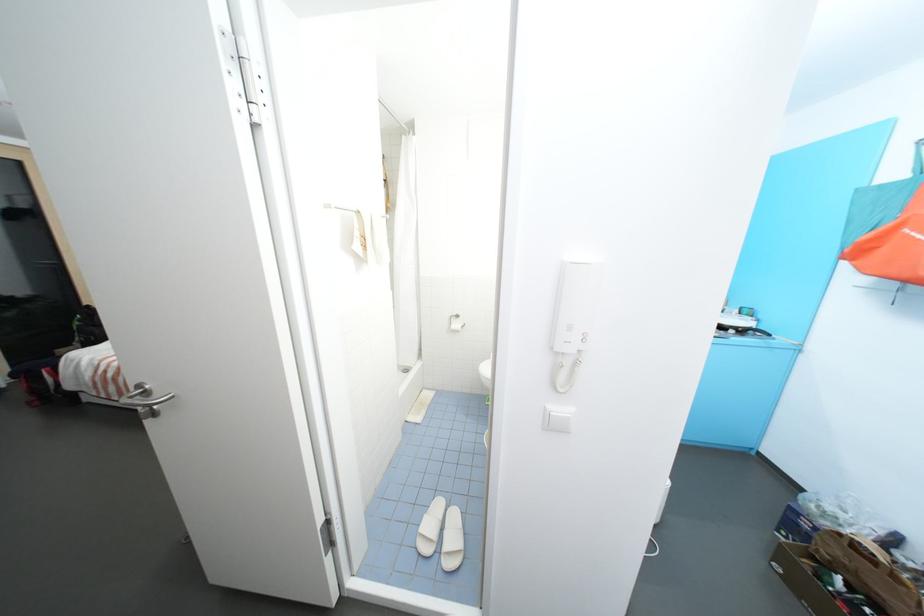
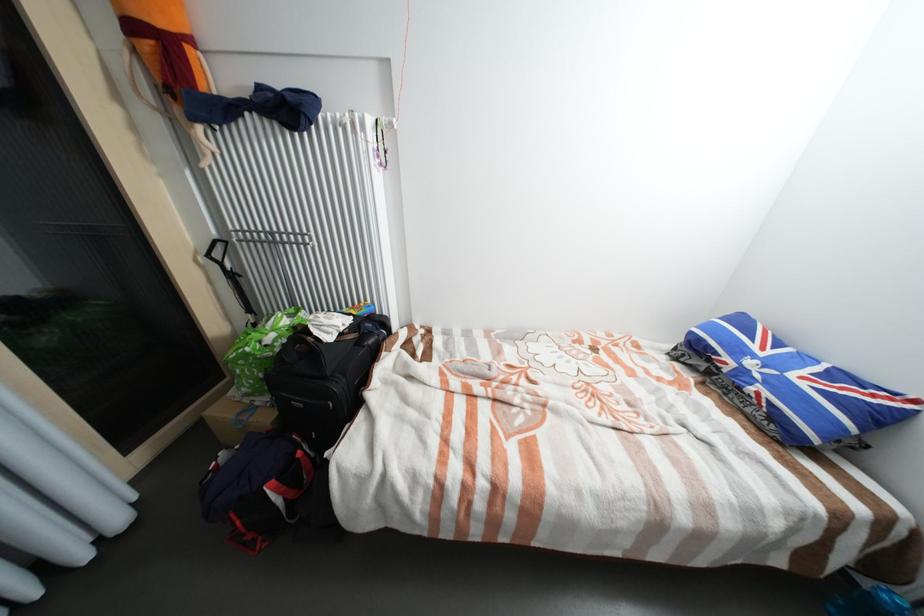
The images are taken continuously from a first-person perspective. In which direction are you moving?

The cameraman moved toward left, forward.